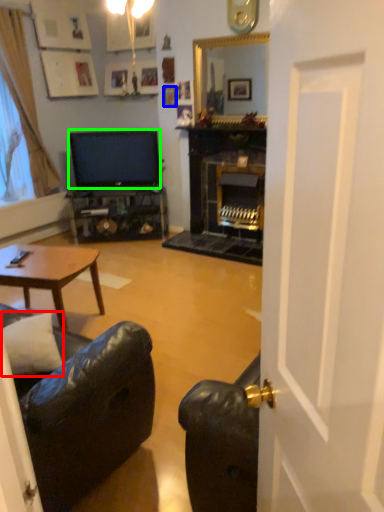
Question: Estimate the real-world distances between objects in this image. Which object is closer to pillow (highlighted by a red box), picture frame (highlighted by a blue box) or television (highlighted by a green box)?

Choices:
 (A) picture frame
 (B) television

Answer: (B)